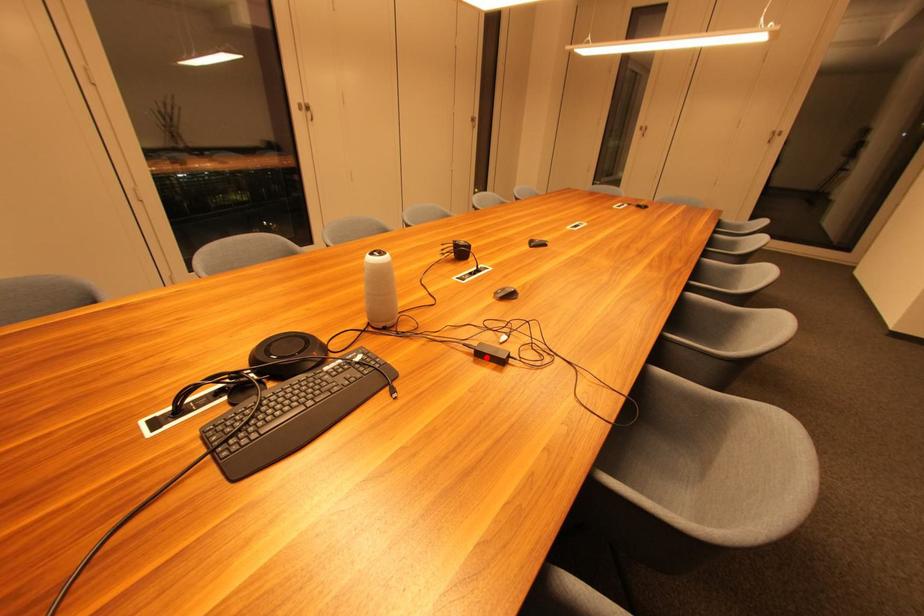
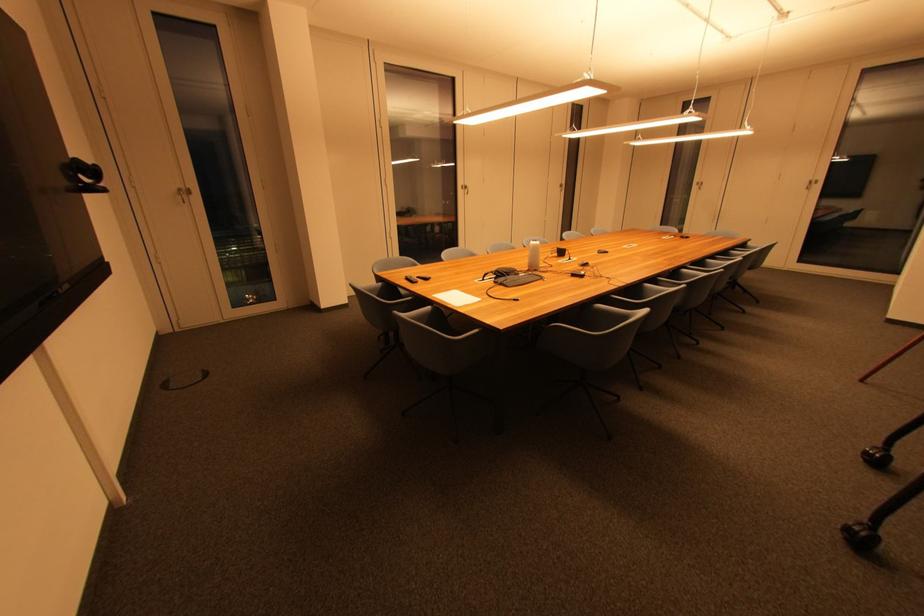
In the second image, find the point that corresponds to the highlighted location in the first image.

(578, 277)